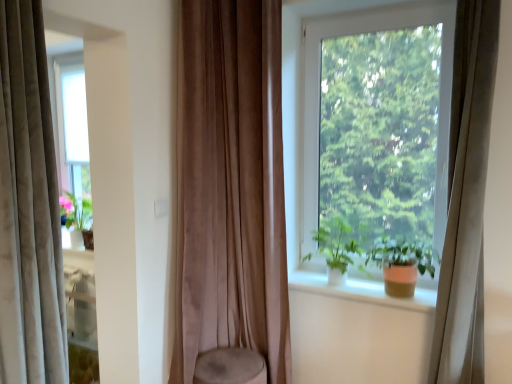
Find the location of a particular element. The height and width of the screenshot is (384, 512). free region under matte orange pot at window (from a real-world perspective) is located at coordinates (405, 296).